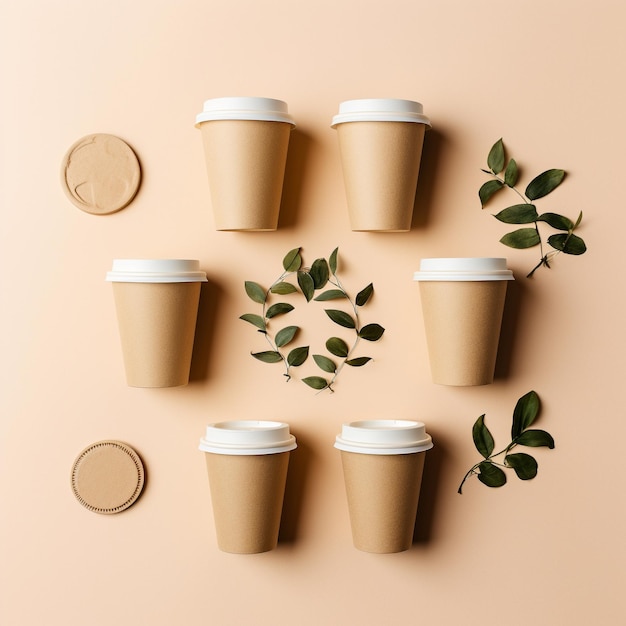
You are a GUI agent. You are given a task and a screenshot of the screen. Output one action in this format:
    pyautogui.click(x=<x>, y=<y>)
    Task: Click on the cups for coffee
    
    Given the screenshot: What is the action you would take?
    pyautogui.click(x=260, y=495), pyautogui.click(x=391, y=480), pyautogui.click(x=451, y=320), pyautogui.click(x=359, y=161), pyautogui.click(x=231, y=167), pyautogui.click(x=173, y=326)